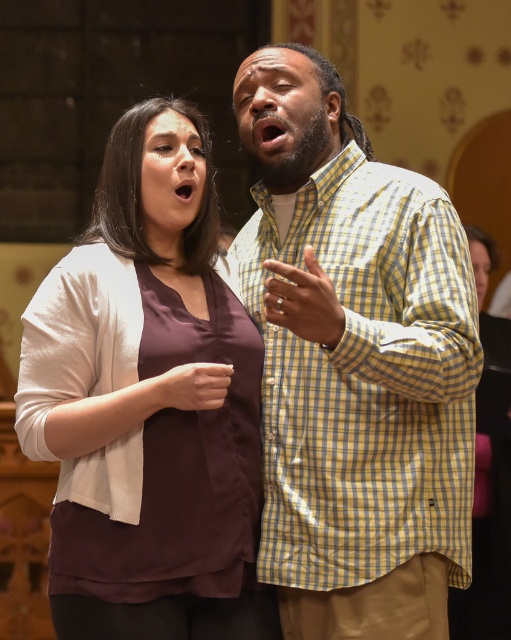
Question: Which of the following is the farthest from the observer?

Choices:
 (A) matte brown blouse at center
 (B) yellow checkered shirt at center

Answer: (A)

Question: In this image, where is yellow checkered shirt at center located relative to matte brown blouse at center?

Choices:
 (A) above
 (B) below

Answer: (B)

Question: Which point is farther to the camera?

Choices:
 (A) (206, 474)
 (B) (270, 45)

Answer: (B)

Question: Can you confirm if yellow checkered shirt at center is positioned to the right of matte brown blouse at center?

Choices:
 (A) yes
 (B) no

Answer: (A)

Question: Which object appears closest to the camera in this image?

Choices:
 (A) matte brown blouse at center
 (B) yellow checkered shirt at center

Answer: (B)

Question: Is yellow checkered shirt at center positioned behind matte brown blouse at center?

Choices:
 (A) no
 (B) yes

Answer: (A)